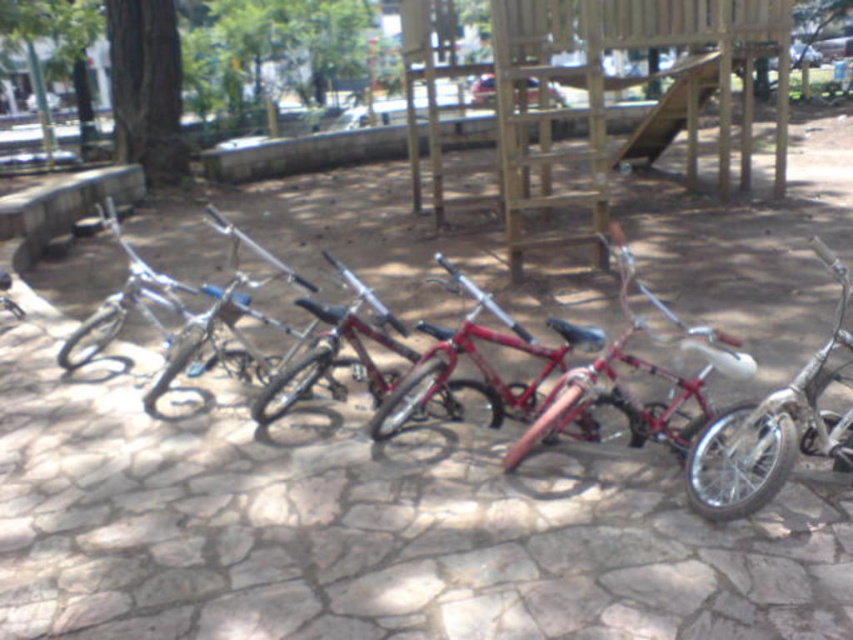
Is shiny silver bicycle at center thinner than shiny red bicycle at center?

Yes, shiny silver bicycle at center is thinner than shiny red bicycle at center.

Does shiny silver bicycle at center have a greater width compared to shiny red bicycle at center?

No, shiny silver bicycle at center is not wider than shiny red bicycle at center.

Identify the location of shiny silver bicycle at center. (775, 428).

Does metallic silver bicycle at center appear on the left side of shiny silver bicycle at center?

Indeed, metallic silver bicycle at center is positioned on the left side of shiny silver bicycle at center.

Measure the distance between metallic silver bicycle at center and shiny silver bicycle at center.

18.53 inches

Is point (730, 472) behind point (814, 387)?

No, it is not.

Identify the location of metallic silver bicycle at center. The height and width of the screenshot is (640, 853). (722, 422).

Which is more to the left, metallic silver bicycle at center or shiny red bicycle at center?

shiny red bicycle at center is more to the left.

Who is positioned more to the right, metallic silver bicycle at center or shiny red bicycle at center?

metallic silver bicycle at center is more to the right.

The height and width of the screenshot is (640, 853). Identify the location of metallic silver bicycle at center. (722, 422).